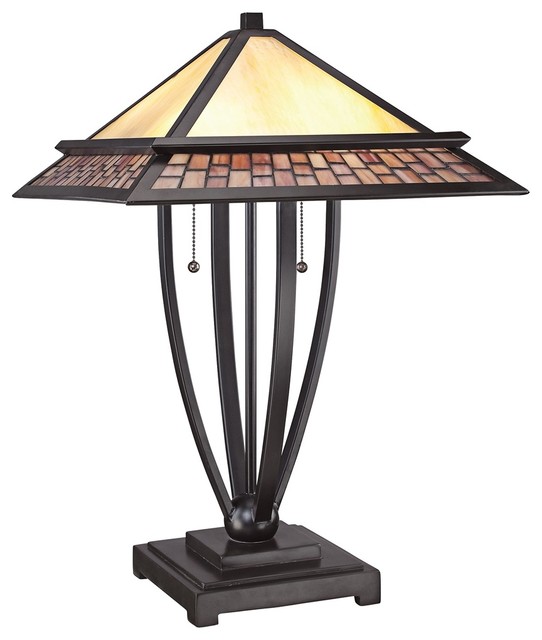
Image resolution: width=542 pixels, height=640 pixels. Find the location of `support beam`. support beam is located at coordinates [x=179, y=352], [x=218, y=338], [x=254, y=322], [x=289, y=335], [x=316, y=340].